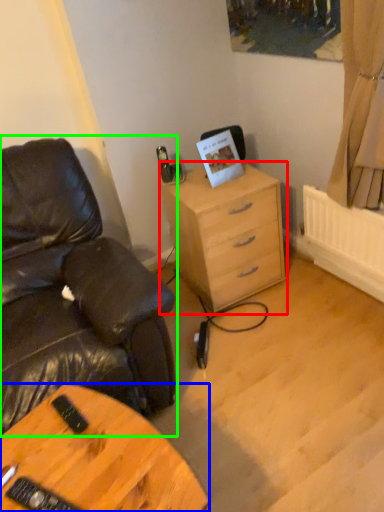
Question: Which object is positioned closest to chest of drawers (highlighted by a red box)? Select from desk (highlighted by a blue box) and chair (highlighted by a green box).

Choices:
 (A) desk
 (B) chair

Answer: (B)